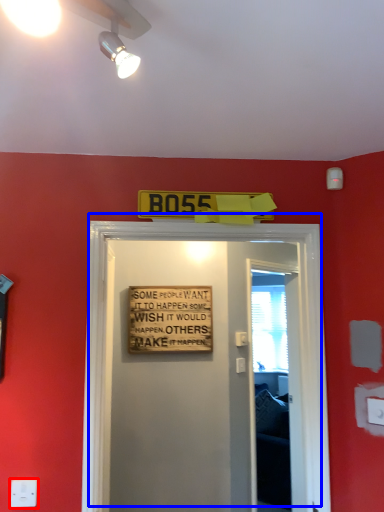
Question: Which object is closer to the camera taking this photo, electric outlet (highlighted by a red box) or door (highlighted by a blue box)?

Choices:
 (A) electric outlet
 (B) door

Answer: (A)